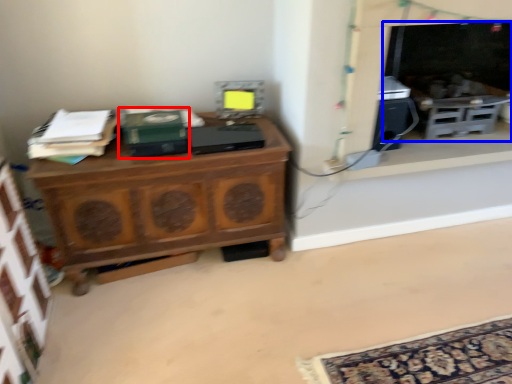
Question: Which object is further to the camera taking this photo, book (highlighted by a red box) or fireplace (highlighted by a blue box)?

Choices:
 (A) book
 (B) fireplace

Answer: (B)